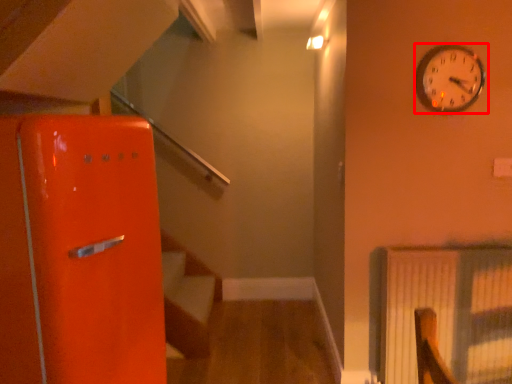
Question: Considering the relative positions of wall clock (annotated by the red box) and radiator in the image provided, where is wall clock (annotated by the red box) located with respect to the staircase?

Choices:
 (A) left
 (B) right

Answer: (A)